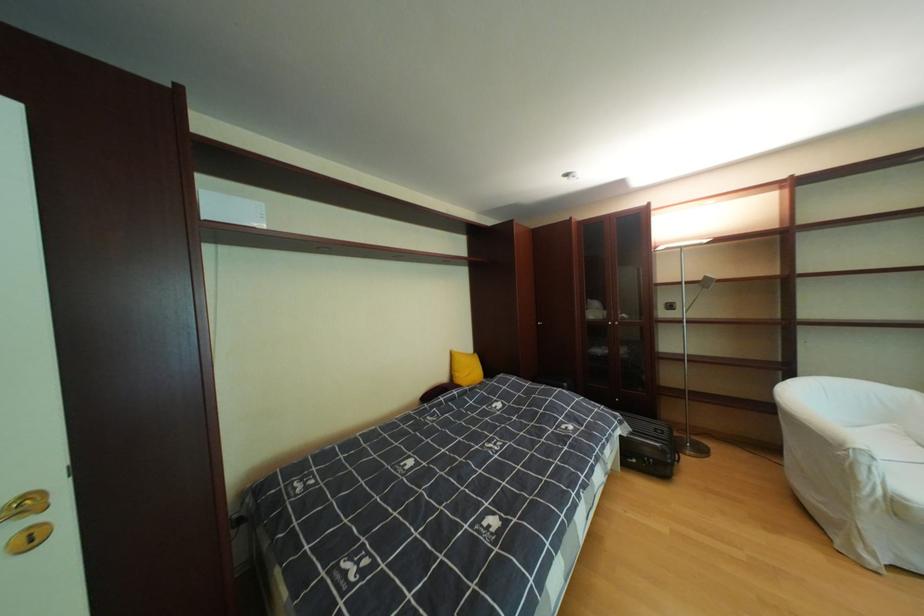
This screenshot has height=616, width=924. What do you see at coordinates (896, 468) in the screenshot?
I see `the sofa armrest` at bounding box center [896, 468].